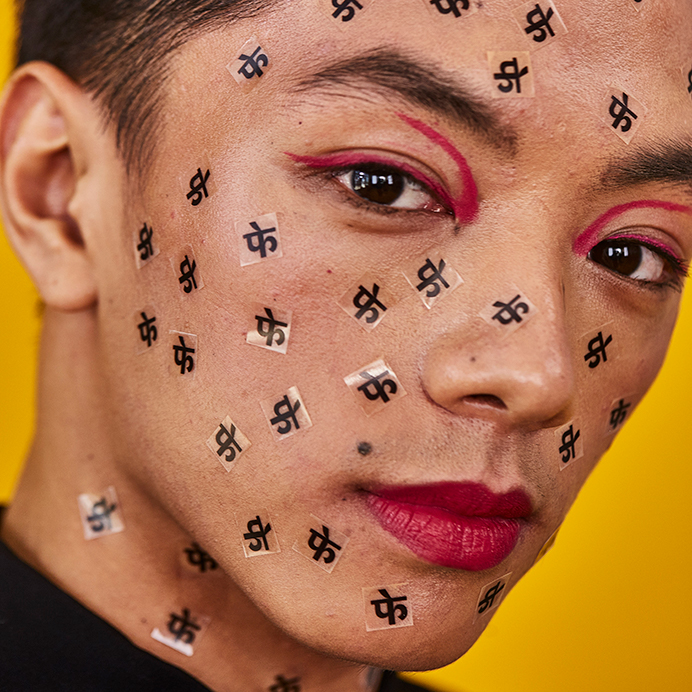
Identify the location of sticker. This screenshot has height=692, width=692. (291, 682).